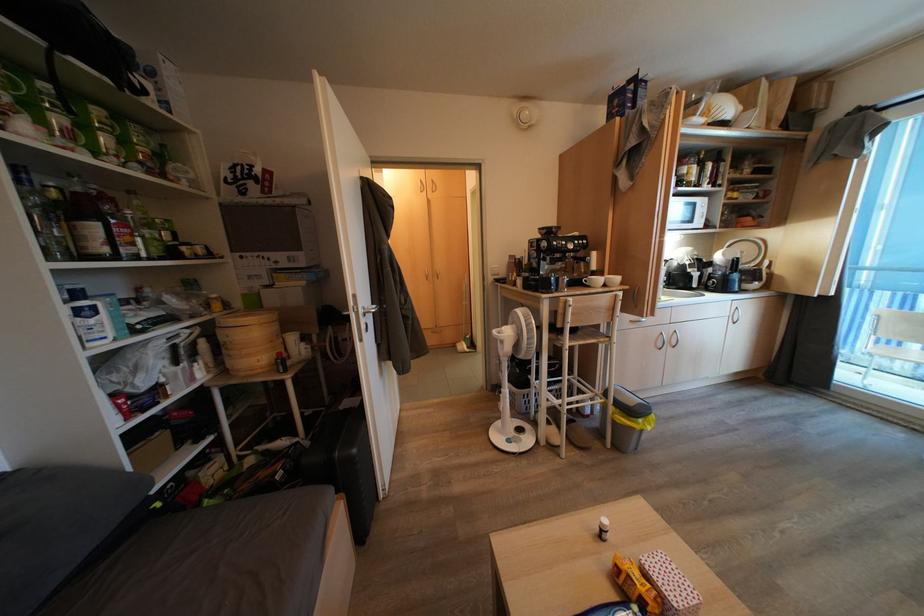
Image resolution: width=924 pixels, height=616 pixels. What do you see at coordinates (734, 265) in the screenshot? I see `the black kettle handle` at bounding box center [734, 265].